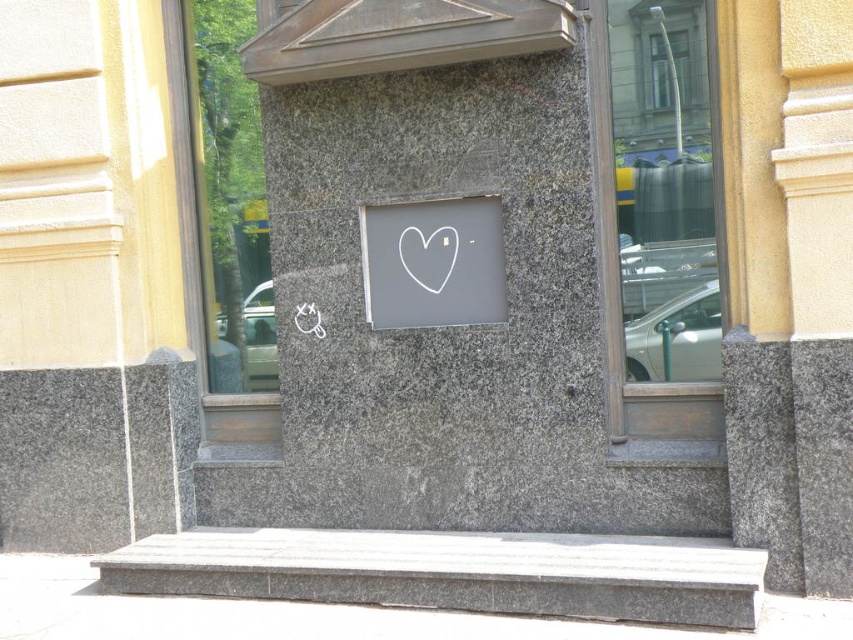
Question: Is white chalk heart at center to the right of white matte heart at center from the viewer's perspective?

Choices:
 (A) yes
 (B) no

Answer: (A)

Question: Which point is farther from the camera taking this photo?

Choices:
 (A) (405, 312)
 (B) (444, 228)

Answer: (A)

Question: Which point is farther to the camera?

Choices:
 (A) (456, 243)
 (B) (389, 232)

Answer: (B)

Question: Where is white chalk heart at center located in relation to white matte heart at center in the image?

Choices:
 (A) above
 (B) below

Answer: (B)

Question: Is the position of white chalk heart at center more distant than that of white matte heart at center?

Choices:
 (A) yes
 (B) no

Answer: (B)